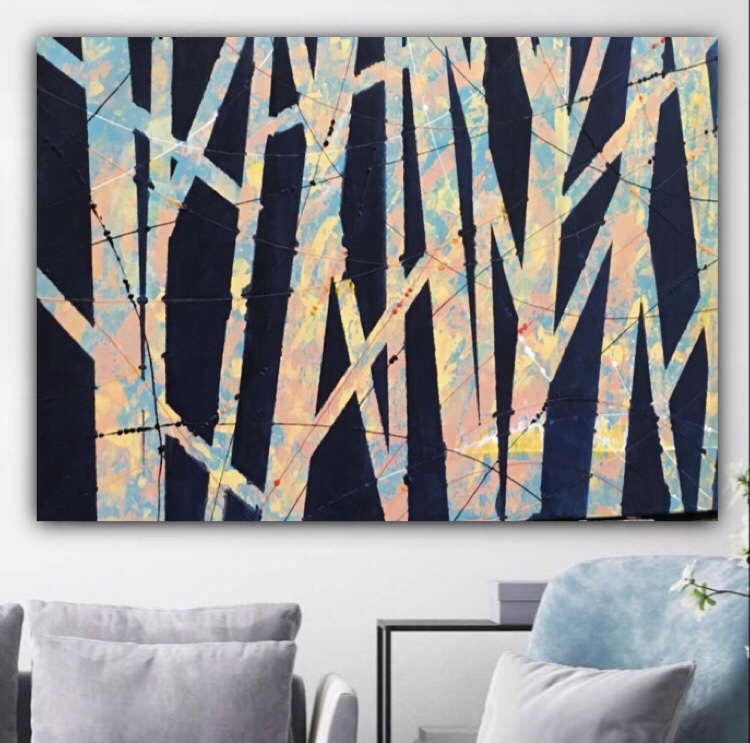
Where is `cushion`? This screenshot has width=750, height=743. cushion is located at coordinates pos(176,623).